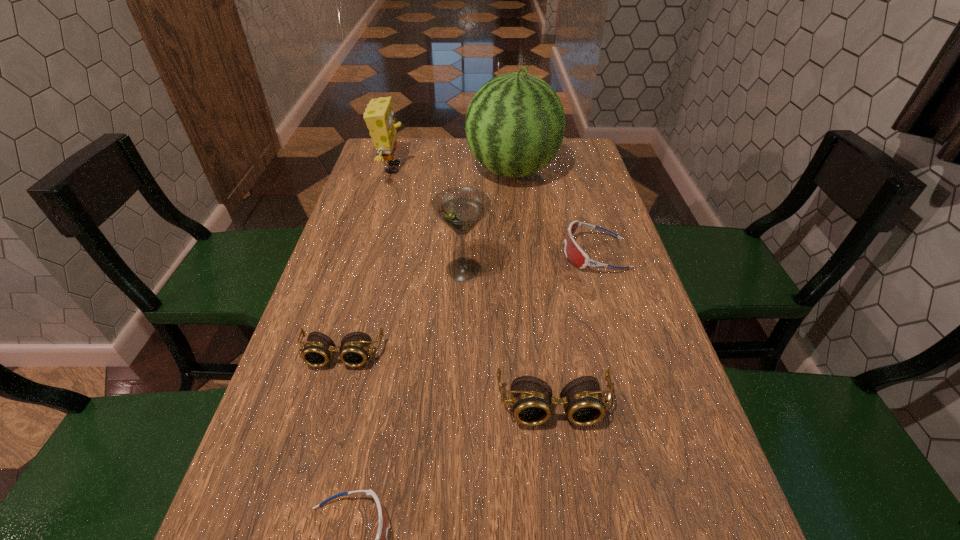
Locate an element on the screen. vacant region that satisfies the following two spatial constraints: 1. on the face of the sponge; 2. on the left side of the martini is located at coordinates (362, 270).

Locate an element on the screen. free location that satisfies the following two spatial constraints: 1. on the front-facing side of the right red goggles; 2. through the lenses of the fifth farthest object is located at coordinates (625, 355).

Locate an element on the screen. Image resolution: width=960 pixels, height=540 pixels. vacant area in the image that satisfies the following two spatial constraints: 1. on the face of the martini; 2. on the right side of the yellow sponge is located at coordinates (362, 270).